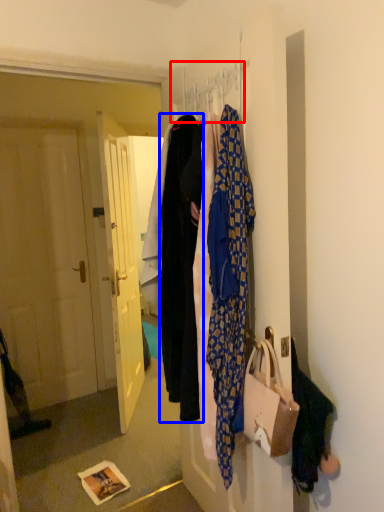
Question: Which object appears farthest to the camera in this image, hanger (highlighted by a red box) or garment (highlighted by a blue box)?

Choices:
 (A) hanger
 (B) garment

Answer: (B)